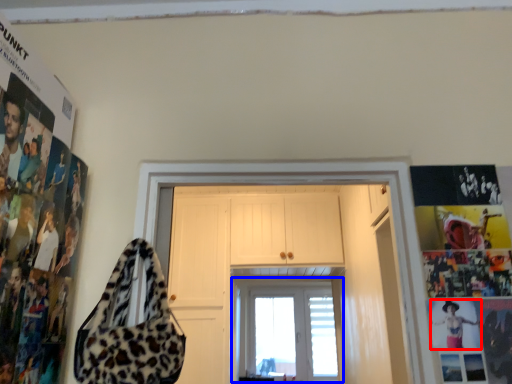
Question: Which of the following is the closest to the observer, person (highlighted by a red box) or window (highlighted by a blue box)?

Choices:
 (A) person
 (B) window

Answer: (A)